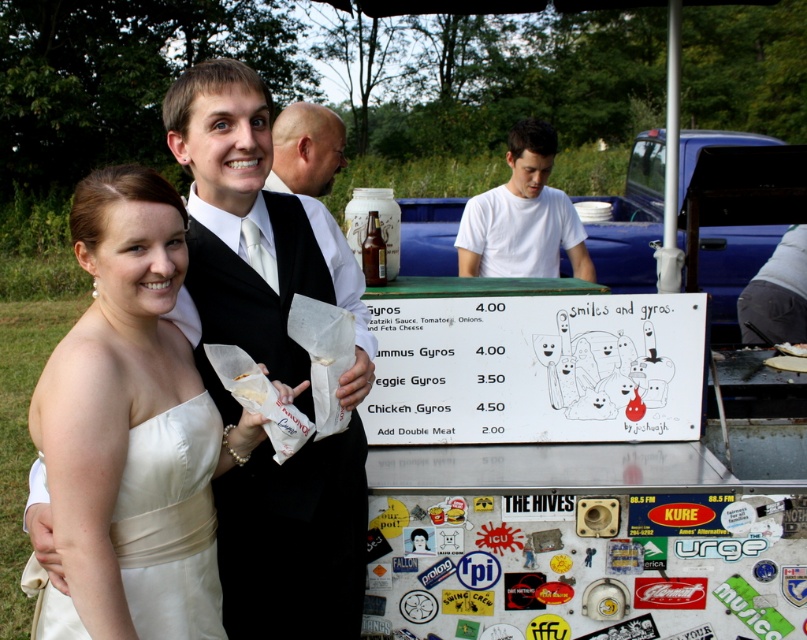
Question: Does white satin dress at left have a larger size compared to satin white dress at left?

Choices:
 (A) no
 (B) yes

Answer: (B)

Question: Which point appears farthest from the camera in this image?

Choices:
 (A) (136, 220)
 (B) (460, 256)
 (C) (199, 134)
 (D) (159, 536)

Answer: (B)

Question: Based on their relative distances, which object is farther from the white matte shirt at center?

Choices:
 (A) smooth bald head at center
 (B) white satin dress at center

Answer: (B)

Question: Considering the relative positions of satin white dress at left and white matte shirt at center in the image provided, where is satin white dress at left located with respect to white matte shirt at center?

Choices:
 (A) above
 (B) below

Answer: (B)

Question: Is white satin dress at center thinner than smooth bald head at center?

Choices:
 (A) no
 (B) yes

Answer: (A)

Question: Which object is the farthest from the white satin dress at left?

Choices:
 (A) white satin dress at center
 (B) white matte shirt at center
 (C) satin white dress at left

Answer: (B)